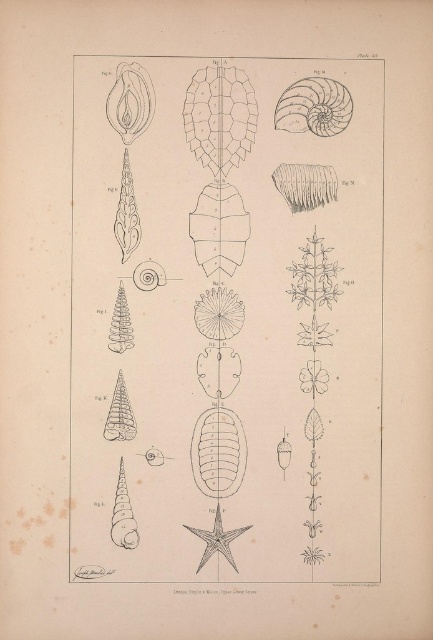
Who is shorter, gray line drawing of starfish at center or matte gray shell at upper right?

matte gray shell at upper right is shorter.

The width and height of the screenshot is (433, 640). Describe the element at coordinates (223, 324) in the screenshot. I see `gray line drawing of starfish at center` at that location.

Does point (174, 428) come closer to viewer compared to point (335, 131)?

That is False.

Find the location of a particular element. gray line drawing of starfish at center is located at coordinates (223, 324).